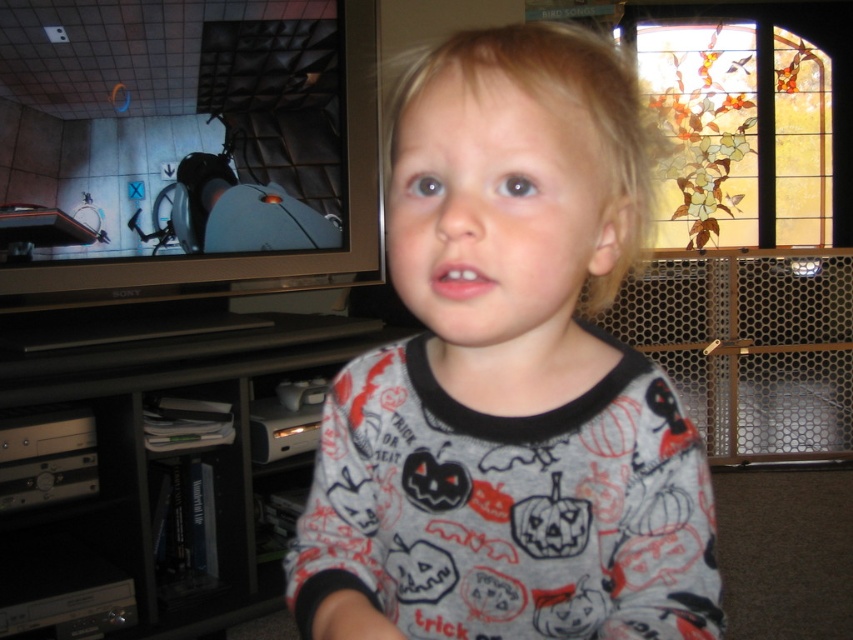
Can you confirm if gray cotton pajamas at center is positioned to the left of black plastic entertainment center at lower left?

No, gray cotton pajamas at center is not to the left of black plastic entertainment center at lower left.

Based on the photo, is gray cotton pajamas at center shorter than black plastic entertainment center at lower left?

Yes.

Who is more distant from viewer, (x=506, y=563) or (x=245, y=600)?

Positioned behind is point (x=245, y=600).

The height and width of the screenshot is (640, 853). I want to click on gray cotton pajamas at center, so click(509, 378).